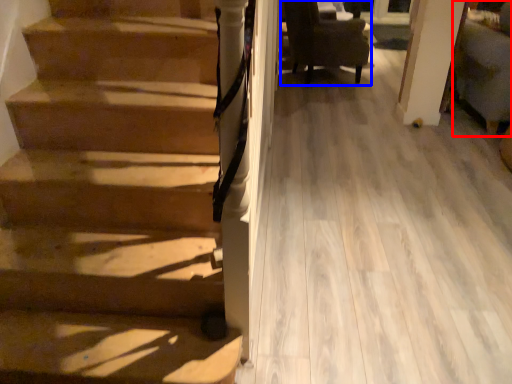
Question: Which of the following is the closest to the observer, armchair (highlighted by a red box) or chair (highlighted by a blue box)?

Choices:
 (A) armchair
 (B) chair

Answer: (A)